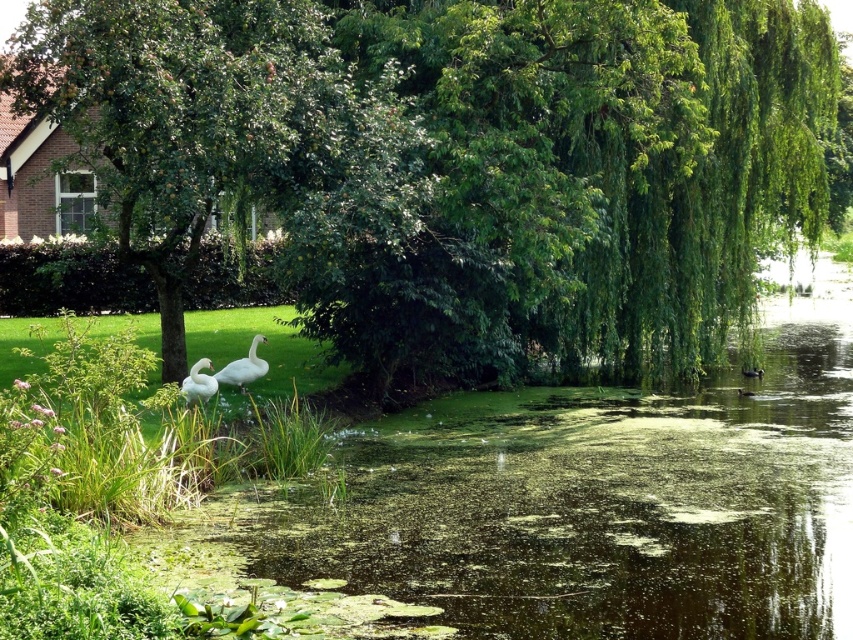
Is green leafy tree at center shorter than green algae-covered water at center-left?

In fact, green leafy tree at center may be taller than green algae-covered water at center-left.

Does point (410, 65) lie behind point (405, 573)?

Yes, it is.

You are a GUI agent. You are given a task and a screenshot of the screen. Output one action in this format:
    pyautogui.click(x=<x>, y=<y>)
    Task: Click on the green leafy tree at center
    
    Given the screenshot: What is the action you would take?
    pyautogui.click(x=471, y=160)

Between point (712, 141) and point (195, 374), which one is positioned in front?

Positioned in front is point (195, 374).

Identify the location of green leafy tree at center. The image size is (853, 640). (471, 160).

Looking at this image, is the position of green algae-covered water at center-left more distant than that of white feathered swan at lower left?

No, it is not.

Who is higher up, green algae-covered water at center-left or white feathered swan at lower left?

white feathered swan at lower left is higher up.

You are a GUI agent. You are given a task and a screenshot of the screen. Output one action in this format:
    pyautogui.click(x=<x>, y=<y>)
    Task: Click on the green algae-covered water at center-left
    
    Given the screenshot: What is the action you would take?
    pyautogui.click(x=578, y=504)